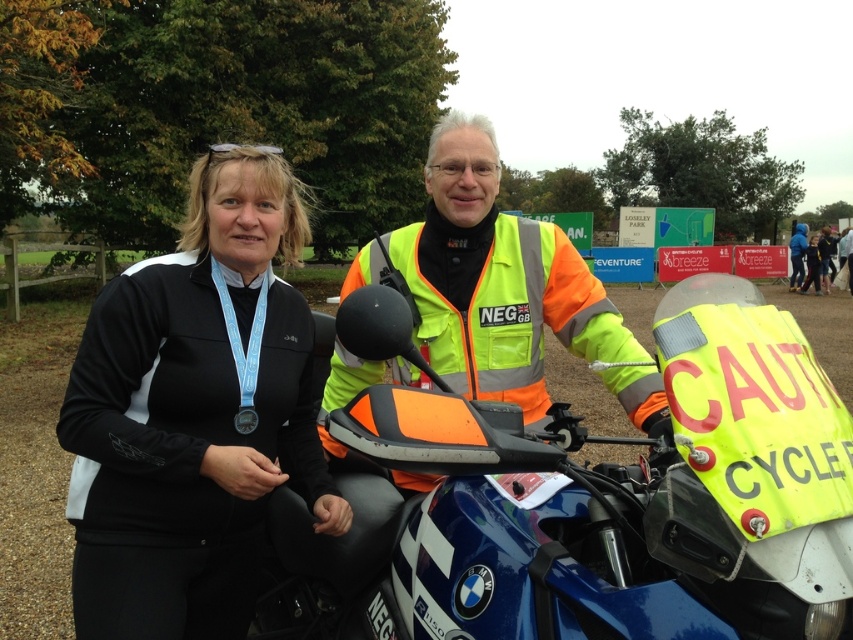
You are a photographer at the event and want to capture both the metallic blue motorcycle at center and the silver metallic medal at center in a single frame. The camera you are using has a minimum focusing distance of 28 inches. Can you take the photo without moving either object?

The metallic blue motorcycle at center is 27.41 inches away from the silver metallic medal at center. Since the distance between them is less than the camera minimum focusing distance of 28 inches, you cannot capture both in a single frame without moving them.

In the scene shown: You are a photographer at the event and want to capture both the metallic blue motorcycle at center and the silver metallic medal at center in a single photo. Which object should you focus on first to ensure both are in frame?

The metallic blue motorcycle at center is much taller than the silver metallic medal at center, so you should focus on the motorcycle first to ensure both are in frame.

You are a photographer trying to capture a clear shot of both the black matte jacket at center and the neon yellow reflective safety vest at center. Based on their positions, which one is closer to the ground?

The black matte jacket at center is located below the neon yellow reflective safety vest at center, meaning it is closer to the ground.